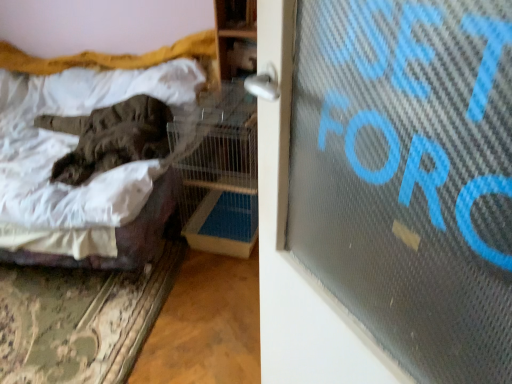
Question: Is dark gray fur cat at left to the left or to the right of velvet brown blanket at left in the image?

Choices:
 (A) left
 (B) right

Answer: (B)

Question: From a real-world perspective, is dark gray fur cat at left physically located above or below velvet brown blanket at left?

Choices:
 (A) below
 (B) above

Answer: (B)

Question: From the image's perspective, is dark gray fur cat at left above or below velvet brown blanket at left?

Choices:
 (A) below
 (B) above

Answer: (B)

Question: Considering the relative positions of velvet brown blanket at left and dark gray fur cat at left in the image provided, is velvet brown blanket at left to the left or to the right of dark gray fur cat at left?

Choices:
 (A) right
 (B) left

Answer: (B)

Question: From a real-world perspective, is velvet brown blanket at left positioned above or below dark gray fur cat at left?

Choices:
 (A) below
 (B) above

Answer: (A)

Question: Considering the positions of point (215, 51) and point (78, 130), is point (215, 51) closer or farther from the camera than point (78, 130)?

Choices:
 (A) closer
 (B) farther

Answer: (B)

Question: From the image's perspective, is velvet brown blanket at left positioned above or below dark gray fur cat at left?

Choices:
 (A) below
 (B) above

Answer: (A)